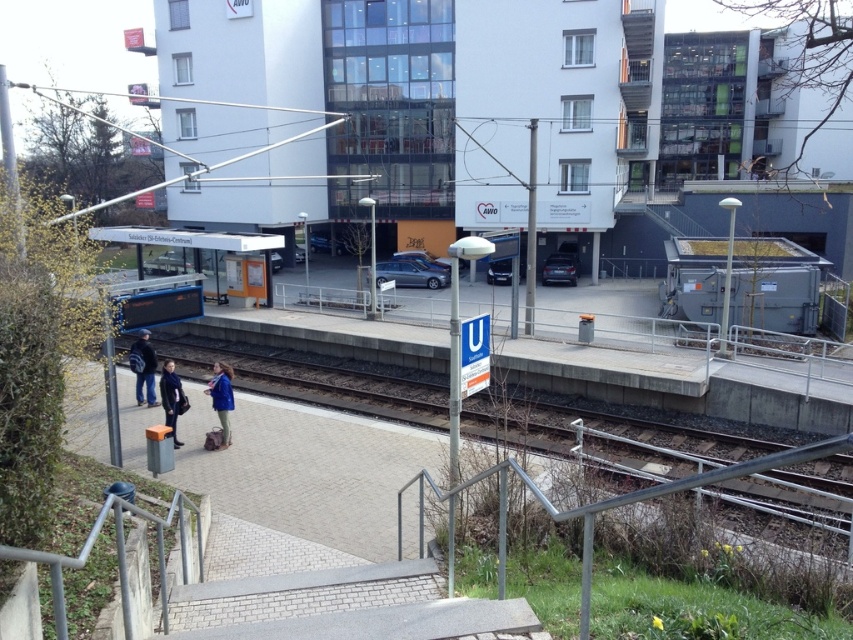
In the scene shown: You are a delivery person who needs to place a package on the platform at the tram station. The package must be placed exactly at the coordinates given for the blue fabric coat at center. Where should you place the package?

Place the package at the coordinates point (221, 397) where the blue fabric coat at center is located.

You are a photographer standing at the tram station. You want to take a photo of both the dark blue jacket at center and the blue fabric coat at center so that both are fully visible in the frame. Which object should you adjust your camera angle to focus on to ensure the wider one is captured without cropping?

The dark blue jacket at center might be wider than blue fabric coat at center, so you should focus on the dark blue jacket at center to ensure it fits in the frame without cropping.

You are a passenger at the tram station and you see two people wearing dark blue jacket at center and blue fabric coat at center. Which person is taller?

The dark blue jacket at center is much taller than the blue fabric coat at center.